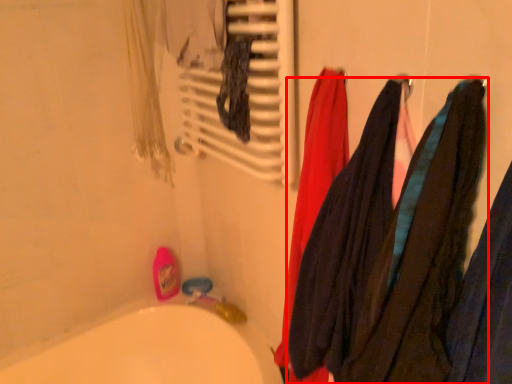
Question: From the image's perspective, where is towel (annotated by the red box) located relative to radiator?

Choices:
 (A) below
 (B) above

Answer: (A)